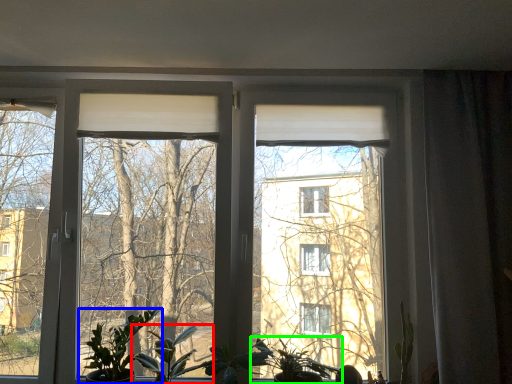
Question: Based on their relative distances, which object is farther from houseplant (highlighted by a red box)? Choose from houseplant (highlighted by a blue box) and houseplant (highlighted by a green box).

Choices:
 (A) houseplant
 (B) houseplant

Answer: (B)